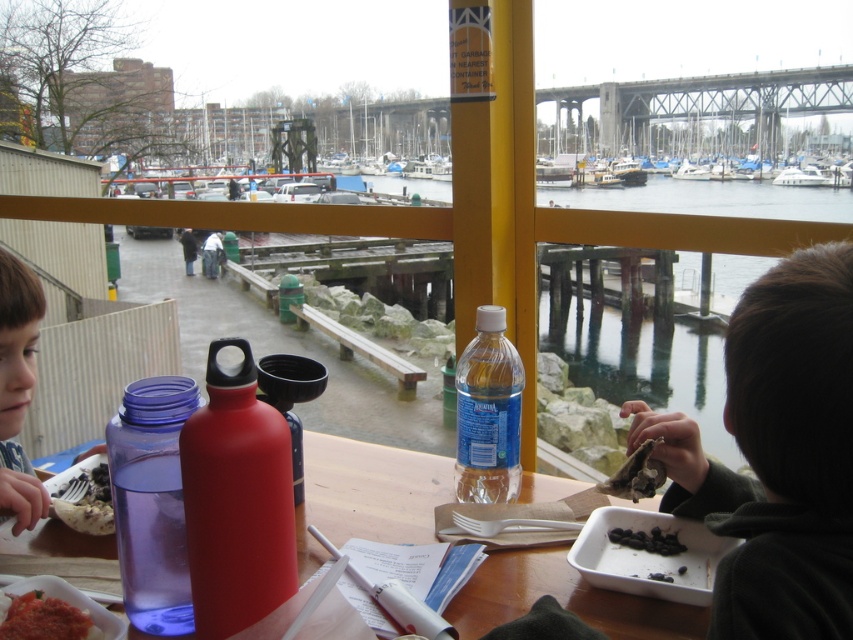
Question: Which point is closer to the camera?

Choices:
 (A) (659, 547)
 (B) (102, 518)
 (C) (662, 564)
 (D) (186, 243)

Answer: (C)

Question: Estimate the real-world distances between objects in this image. Which object is farther from the translucent plastic bottle at center?

Choices:
 (A) black jacket at center
 (B) dark brown hoodie at lower right

Answer: (A)

Question: Is dark brown hoodie at lower right positioned before black matte tray at lower right?

Choices:
 (A) yes
 (B) no

Answer: (A)

Question: Estimate the real-world distances between objects in this image. Which object is closer to the dark brown hoodie at lower right?

Choices:
 (A) transparent plastic water bottle at center
 (B) wooden table at center
 (C) black matte tray at lower right
 (D) smooth pinkish paste at lower left

Answer: (C)

Question: Is dark brown textured bread at lower left to the right of black jacket at center from the viewer's perspective?

Choices:
 (A) yes
 (B) no

Answer: (A)

Question: Does wooden table at center appear on the left side of black matte tray at lower right?

Choices:
 (A) no
 (B) yes

Answer: (B)